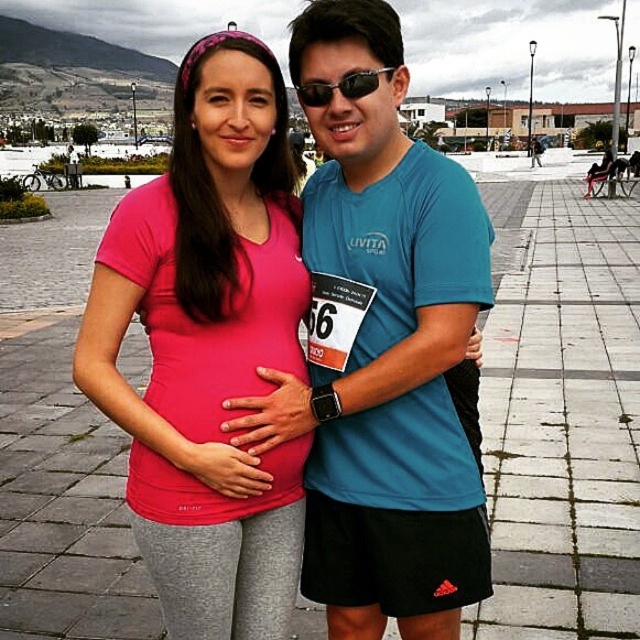
Does gray concrete pavement at center appear on the left side of matte pink shirt at center?

No, gray concrete pavement at center is not to the left of matte pink shirt at center.

Between point (67, 561) and point (180, 100), which one is positioned behind?

The point (67, 561) is more distant.

Which is in front, point (568, 547) or point (244, 157)?

Point (244, 157) is in front.

Locate an element on the screen. The width and height of the screenshot is (640, 640). gray concrete pavement at center is located at coordinates (561, 416).

Does gray concrete pavement at center have a greater height compared to sunglasses at center?

Yes, gray concrete pavement at center is taller than sunglasses at center.

Does point (483, 378) come behind point (312, 93)?

Yes, it is.

I want to click on gray concrete pavement at center, so click(561, 416).

Does matte pink shirt at center appear on the left side of sunglasses at center?

Indeed, matte pink shirt at center is positioned on the left side of sunglasses at center.

At what (x,y) coordinates should I click in order to perform the action: click on matte pink shirt at center. Please return your answer as a coordinate pair (x, y). Looking at the image, I should click on (208, 346).

Between point (132, 227) and point (372, 77), which one is positioned in front?

Point (372, 77) is in front.

The width and height of the screenshot is (640, 640). Identify the location of matte pink shirt at center. (208, 346).